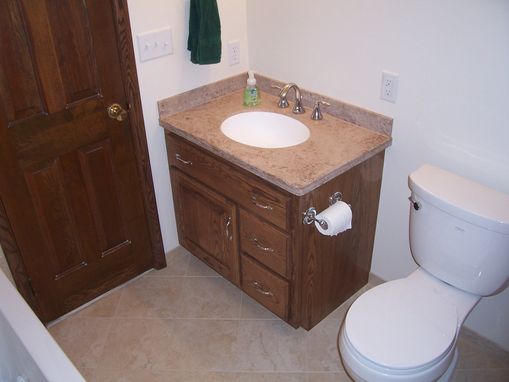
The width and height of the screenshot is (509, 382). Find the location of `large cabinet`. large cabinet is located at coordinates (216, 223).